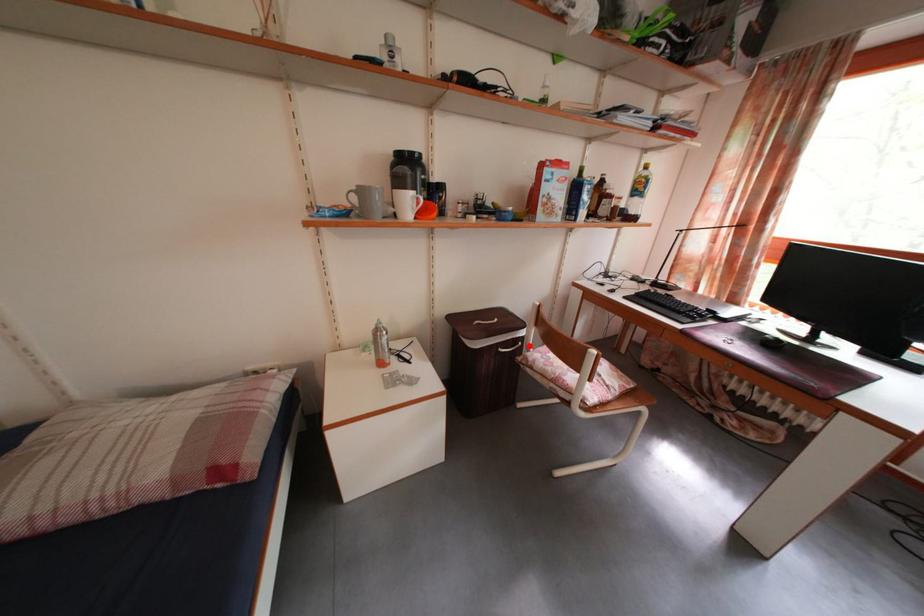
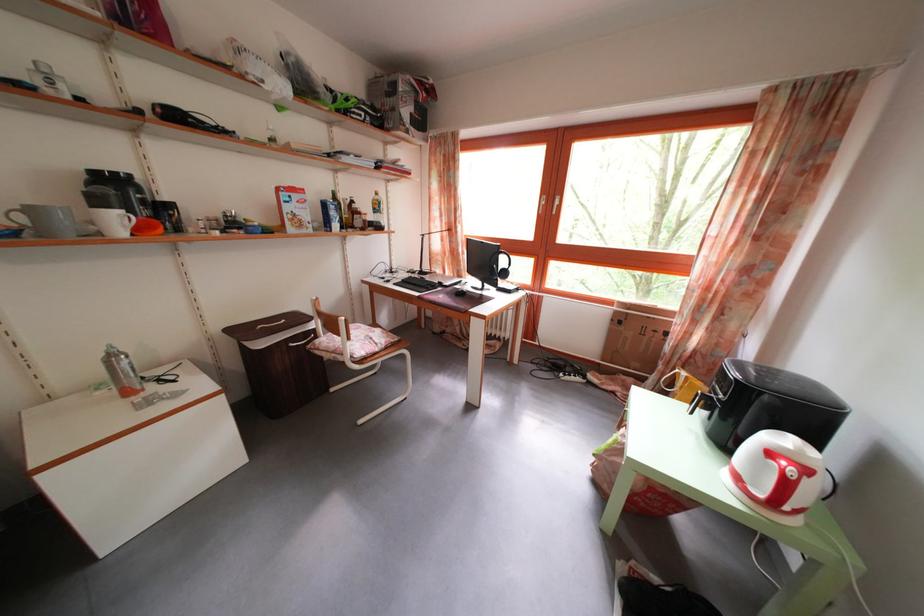
In the second image, find the point that corresponds to the highlighted location in the first image.

(322, 339)